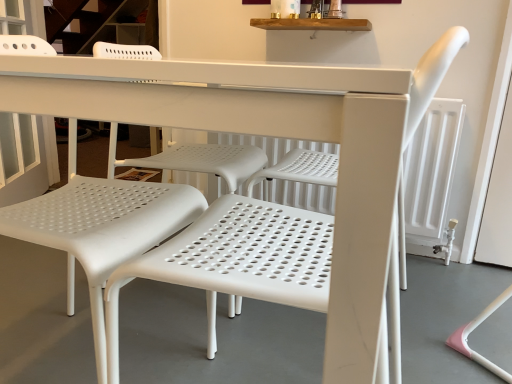
At what (x,y) coordinates should I click in order to perform the action: click on white perforated plastic chair at left, the first chair viewed from the left. Please return your answer as a coordinate pair (x, y). The width and height of the screenshot is (512, 384). Looking at the image, I should click on (100, 228).

This screenshot has height=384, width=512. What do you see at coordinates (100, 228) in the screenshot?
I see `white perforated plastic chair at left, the first chair viewed from the left` at bounding box center [100, 228].

Describe the element at coordinates (244, 251) in the screenshot. This screenshot has height=384, width=512. I see `white perforated plastic chair at center, acting as the 1th chair starting from the right` at that location.

How much space does white perforated plastic chair at center, which ranks as the second chair in left-to-right order, occupy horizontally?

white perforated plastic chair at center, which ranks as the second chair in left-to-right order, is 19.08 inches in width.

Where is `white perforated plastic chair at center, which ranks as the second chair in left-to-right order`? The width and height of the screenshot is (512, 384). white perforated plastic chair at center, which ranks as the second chair in left-to-right order is located at coordinates (244, 251).

Where is `white perforated plastic chair at left, the first chair viewed from the left`? The width and height of the screenshot is (512, 384). white perforated plastic chair at left, the first chair viewed from the left is located at coordinates (100, 228).

Considering the positions of objects white perforated plastic chair at left, the first chair viewed from the left, and white perforated plastic chair at center, acting as the 1th chair starting from the right, in the image provided, who is more to the right, white perforated plastic chair at left, the first chair viewed from the left, or white perforated plastic chair at center, acting as the 1th chair starting from the right,?

white perforated plastic chair at center, acting as the 1th chair starting from the right.

Relative to white perforated plastic chair at center, which ranks as the second chair in left-to-right order, is white perforated plastic chair at left, which appears as the 2th chair when viewed from the right, in front or behind?

In the image, white perforated plastic chair at left, which appears as the 2th chair when viewed from the right, appears behind white perforated plastic chair at center, which ranks as the second chair in left-to-right order.

Which is closer to the camera, (30, 36) or (173, 283)?

The point (173, 283) is more forward.

From the image's perspective, which is below, white perforated plastic chair at left, the first chair viewed from the left, or white perforated plastic chair at center, acting as the 1th chair starting from the right?

white perforated plastic chair at center, acting as the 1th chair starting from the right, from the image's perspective.

From a real-world perspective, which is physically below, white perforated plastic chair at left, which appears as the 2th chair when viewed from the right, or white perforated plastic chair at center, which ranks as the second chair in left-to-right order?

white perforated plastic chair at left, which appears as the 2th chair when viewed from the right, is physically lower.

Between white perforated plastic chair at left, the first chair viewed from the left, and white perforated plastic chair at center, acting as the 1th chair starting from the right, which one has larger width?

white perforated plastic chair at left, the first chair viewed from the left, is wider.

Is white perforated plastic chair at left, the first chair viewed from the left, taller or shorter than white perforated plastic chair at center, which ranks as the second chair in left-to-right order?

Clearly, white perforated plastic chair at left, the first chair viewed from the left, is taller compared to white perforated plastic chair at center, which ranks as the second chair in left-to-right order.

Does white perforated plastic chair at left, which appears as the 2th chair when viewed from the right, have a larger size compared to white perforated plastic chair at center, which ranks as the second chair in left-to-right order?

Correct, white perforated plastic chair at left, which appears as the 2th chair when viewed from the right, is larger in size than white perforated plastic chair at center, which ranks as the second chair in left-to-right order.

Is white perforated plastic chair at left, which appears as the 2th chair when viewed from the right, surrounding white perforated plastic chair at center, which ranks as the second chair in left-to-right order?

No, white perforated plastic chair at center, which ranks as the second chair in left-to-right order, is not surrounded by white perforated plastic chair at left, which appears as the 2th chair when viewed from the right.

Looking at this image, is white perforated plastic chair at left, which appears as the 2th chair when viewed from the right, next to white perforated plastic chair at center, acting as the 1th chair starting from the right?

No, white perforated plastic chair at left, which appears as the 2th chair when viewed from the right, is not in contact with white perforated plastic chair at center, acting as the 1th chair starting from the right.

Is white perforated plastic chair at left, which appears as the 2th chair when viewed from the right, looking in the opposite direction of white perforated plastic chair at center, acting as the 1th chair starting from the right?

white perforated plastic chair at left, which appears as the 2th chair when viewed from the right, does not have its back to white perforated plastic chair at center, acting as the 1th chair starting from the right.

This screenshot has width=512, height=384. I want to click on chair below the white perforated plastic chair at left, the first chair viewed from the left (from the image's perspective), so click(x=244, y=251).

In the scene shown: Which is more to the left, white perforated plastic chair at center, which ranks as the second chair in left-to-right order, or white perforated plastic chair at left, which appears as the 2th chair when viewed from the right?

white perforated plastic chair at left, which appears as the 2th chair when viewed from the right.

Considering the positions of objects white perforated plastic chair at center, which ranks as the second chair in left-to-right order, and white perforated plastic chair at left, the first chair viewed from the left, in the image provided, who is behind, white perforated plastic chair at center, which ranks as the second chair in left-to-right order, or white perforated plastic chair at left, the first chair viewed from the left,?

white perforated plastic chair at left, the first chair viewed from the left, is behind.

Considering the positions of points (254, 270) and (49, 207), is point (254, 270) closer to camera compared to point (49, 207)?

That is True.

From the image's perspective, is white perforated plastic chair at center, which ranks as the second chair in left-to-right order, above or below white perforated plastic chair at left, the first chair viewed from the left?

white perforated plastic chair at center, which ranks as the second chair in left-to-right order, is situated lower than white perforated plastic chair at left, the first chair viewed from the left, in the image.

From a real-world perspective, does white perforated plastic chair at center, which ranks as the second chair in left-to-right order, sit lower than white perforated plastic chair at left, the first chair viewed from the left?

No, from a real-world perspective, white perforated plastic chair at center, which ranks as the second chair in left-to-right order, is not under white perforated plastic chair at left, the first chair viewed from the left.

Is white perforated plastic chair at center, which ranks as the second chair in left-to-right order, wider or thinner than white perforated plastic chair at left, which appears as the 2th chair when viewed from the right?

In the image, white perforated plastic chair at center, which ranks as the second chair in left-to-right order, appears to be more narrow than white perforated plastic chair at left, which appears as the 2th chair when viewed from the right.

Considering the sizes of objects white perforated plastic chair at center, which ranks as the second chair in left-to-right order, and white perforated plastic chair at left, which appears as the 2th chair when viewed from the right, in the image provided, who is shorter, white perforated plastic chair at center, which ranks as the second chair in left-to-right order, or white perforated plastic chair at left, which appears as the 2th chair when viewed from the right,?

Standing shorter between the two is white perforated plastic chair at center, which ranks as the second chair in left-to-right order.

Considering the sizes of objects white perforated plastic chair at center, which ranks as the second chair in left-to-right order, and white perforated plastic chair at left, the first chair viewed from the left, in the image provided, who is bigger, white perforated plastic chair at center, which ranks as the second chair in left-to-right order, or white perforated plastic chair at left, the first chair viewed from the left,?

Bigger between the two is white perforated plastic chair at left, the first chair viewed from the left.

Is white perforated plastic chair at left, which appears as the 2th chair when viewed from the right, inside white perforated plastic chair at center, acting as the 1th chair starting from the right?

No, white perforated plastic chair at left, which appears as the 2th chair when viewed from the right, is not a part of white perforated plastic chair at center, acting as the 1th chair starting from the right.

Are white perforated plastic chair at center, acting as the 1th chair starting from the right, and white perforated plastic chair at left, which appears as the 2th chair when viewed from the right, far apart?

No.

Could you tell me if white perforated plastic chair at center, acting as the 1th chair starting from the right, is facing white perforated plastic chair at left, the first chair viewed from the left?

Yes, white perforated plastic chair at center, acting as the 1th chair starting from the right, faces towards white perforated plastic chair at left, the first chair viewed from the left.

How far apart are white perforated plastic chair at center, which ranks as the second chair in left-to-right order, and white perforated plastic chair at left, which appears as the 2th chair when viewed from the right?

white perforated plastic chair at center, which ranks as the second chair in left-to-right order, and white perforated plastic chair at left, which appears as the 2th chair when viewed from the right, are 9.99 inches apart from each other.

This screenshot has height=384, width=512. In order to click on chair beneath the white perforated plastic chair at center, acting as the 1th chair starting from the right (from a real-world perspective) in this screenshot , I will do `click(100, 228)`.

This screenshot has height=384, width=512. I want to click on chair above the white perforated plastic chair at left, the first chair viewed from the left (from a real-world perspective), so click(x=244, y=251).

This screenshot has height=384, width=512. What are the coordinates of `chair in front of the white perforated plastic chair at left, the first chair viewed from the left` in the screenshot? It's located at (244, 251).